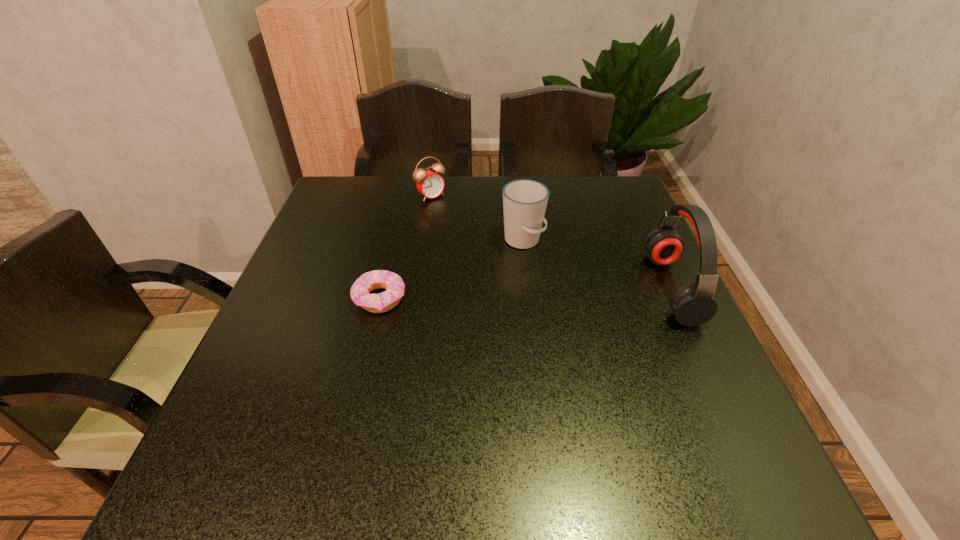
Choose which object is the second nearest neighbor to the cup. Please provide its 2D coordinates. Your answer should be formatted as a tuple, i.e. [(x, y)], where the tuple contains the x and y coordinates of a point satisfying the conditions above.

[(692, 304)]

The width and height of the screenshot is (960, 540). I want to click on object that can be found as the closest to the second shortest object, so click(524, 201).

Identify the location of blank area in the image that satisfies the following two spatial constraints: 1. on the front side of the farthest object; 2. on the left side of the second object from right to left. (424, 241).

Identify the location of vacant position in the image that satisfies the following two spatial constraints: 1. on the front side of the alarm clock; 2. on the ear cups of the rightmost object. This screenshot has width=960, height=540. (417, 288).

The height and width of the screenshot is (540, 960). I want to click on free region that satisfies the following two spatial constraints: 1. on the back side of the shortest object; 2. on the ear cups of the rightmost object, so click(x=382, y=288).

I want to click on free space that satisfies the following two spatial constraints: 1. on the front side of the tallest object; 2. on the ear cups of the second tallest object, so click(x=528, y=288).